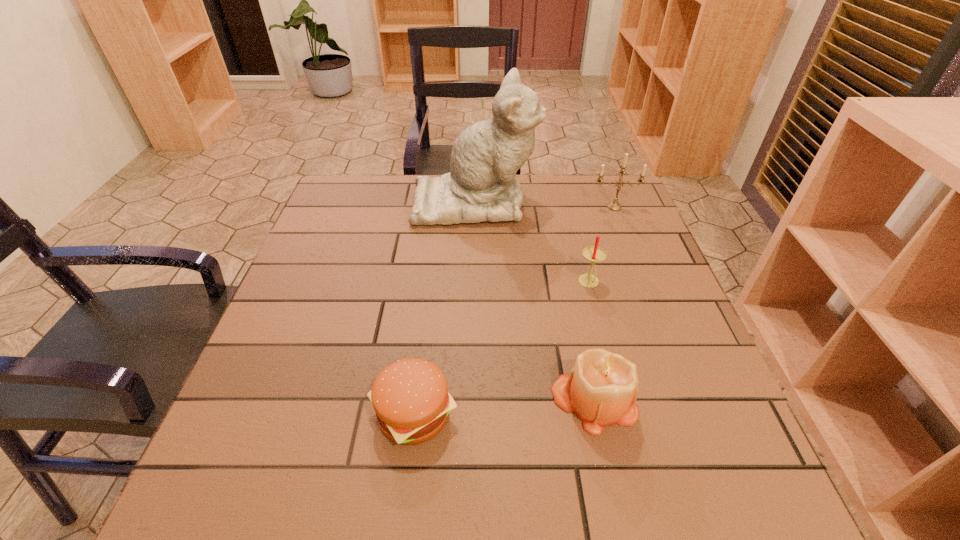
Where is `vacant space that is in between the tallest object and the nearest candle`? vacant space that is in between the tallest object and the nearest candle is located at coordinates (535, 301).

Find the location of a particular element. The height and width of the screenshot is (540, 960). vacant space that is in between the shortest object and the cat is located at coordinates (444, 307).

Image resolution: width=960 pixels, height=540 pixels. In order to click on free spot between the second farthest candle and the tallest object in this screenshot , I will do `click(532, 242)`.

This screenshot has width=960, height=540. I want to click on empty space between the rightmost object and the shortest object, so click(x=515, y=310).

Where is `free spot between the hamburger and the nearest candle`? This screenshot has height=540, width=960. free spot between the hamburger and the nearest candle is located at coordinates (504, 407).

Locate an element on the screen. empty space that is in between the rightmost object and the hamburger is located at coordinates [x=515, y=310].

I want to click on vacant region between the tallest object and the farthest candle, so click(544, 204).

Find the location of a particular element. The width and height of the screenshot is (960, 540). empty space that is in between the second nearest candle and the rightmost candle is located at coordinates (602, 245).

Find the location of a particular element. Image resolution: width=960 pixels, height=540 pixels. object identified as the fourth closest to the third farthest object is located at coordinates (410, 397).

Locate which object ranks second in proximity to the rightmost object. Please provide its 2D coordinates. Your answer should be formatted as a tuple, i.e. [(x, y)], where the tuple contains the x and y coordinates of a point satisfying the conditions above.

[(594, 254)]